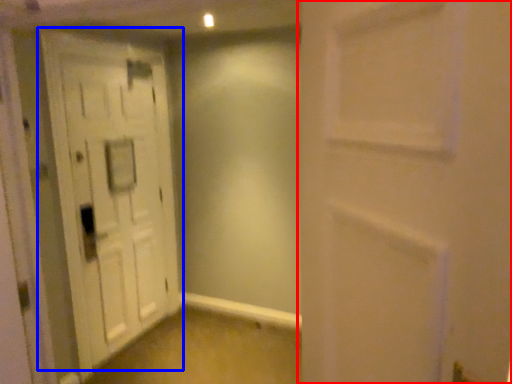
Question: Which point is closer to the camera, door (highlighted by a red box) or door (highlighted by a blue box)?

Choices:
 (A) door
 (B) door

Answer: (A)